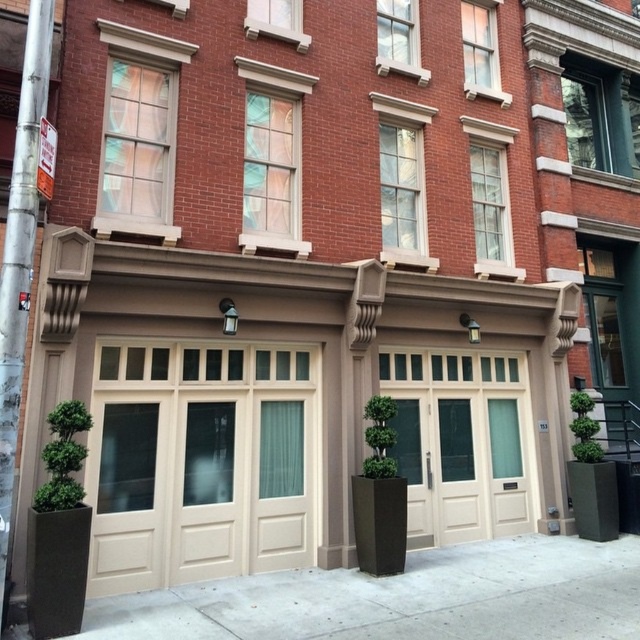
Question: Does beige wood/glass garage door at left have a smaller size compared to gray concrete pavement at lower center?

Choices:
 (A) yes
 (B) no

Answer: (B)

Question: In this image, where is beige wood/glass garage door at left located relative to gray concrete pavement at lower center?

Choices:
 (A) above
 (B) below

Answer: (A)

Question: Which point is closer to the camera?

Choices:
 (A) beige wood/glass garage door at left
 (B) gray concrete pavement at lower center

Answer: (B)

Question: Is beige wood/glass garage door at left positioned at the back of gray concrete pavement at lower center?

Choices:
 (A) yes
 (B) no

Answer: (A)